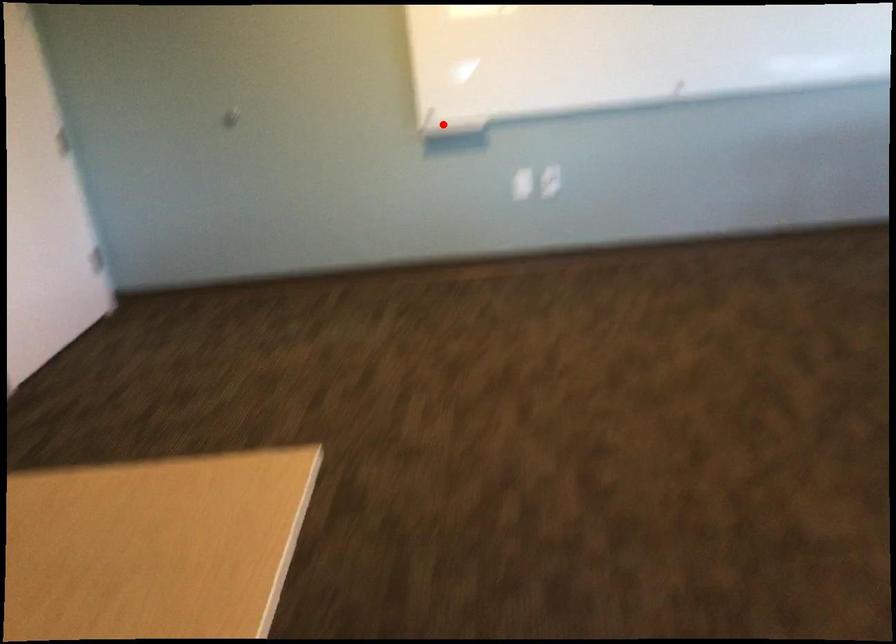
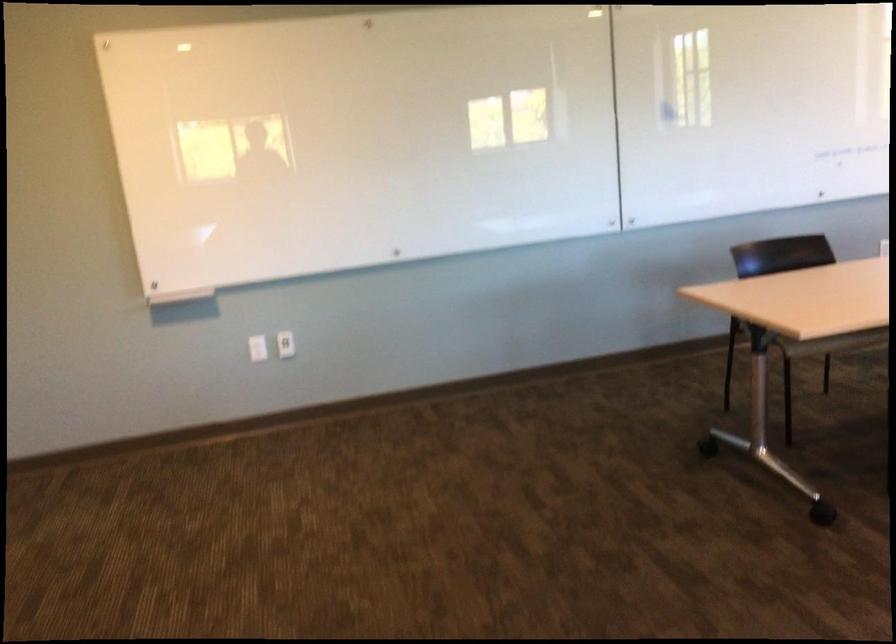
The point at the highlighted location is marked in the first image. Where is the corresponding point in the second image?

(175, 292)